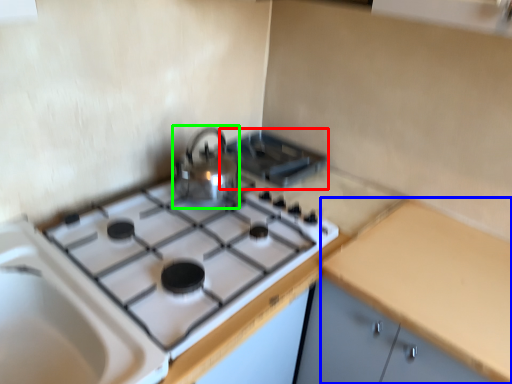
Question: Considering the real-world distances, which object is farthest from appliance (highlighted by a red box)? counter top (highlighted by a blue box) or kitchen appliance (highlighted by a green box)?

Choices:
 (A) counter top
 (B) kitchen appliance

Answer: (A)